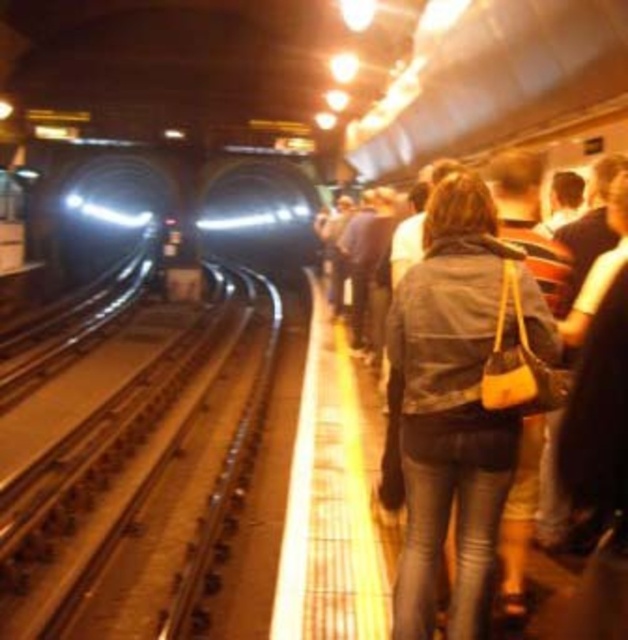
Question: Does metallic smooth train track at center appear on the left side of leather jacket at center?

Choices:
 (A) yes
 (B) no

Answer: (A)

Question: Which object is closer to the camera taking this photo?

Choices:
 (A) metallic smooth train track at center
 (B) leather jacket at center

Answer: (B)

Question: Which point is closer to the camera?

Choices:
 (A) (192, 376)
 (B) (462, 476)

Answer: (B)

Question: Among these points, which one is nearest to the camera?

Choices:
 (A) (28, 588)
 (B) (423, 612)

Answer: (B)

Question: Is metallic smooth train track at center to the right of leather jacket at center from the viewer's perspective?

Choices:
 (A) yes
 (B) no

Answer: (B)

Question: Is metallic smooth train track at center bigger than leather jacket at center?

Choices:
 (A) no
 (B) yes

Answer: (B)